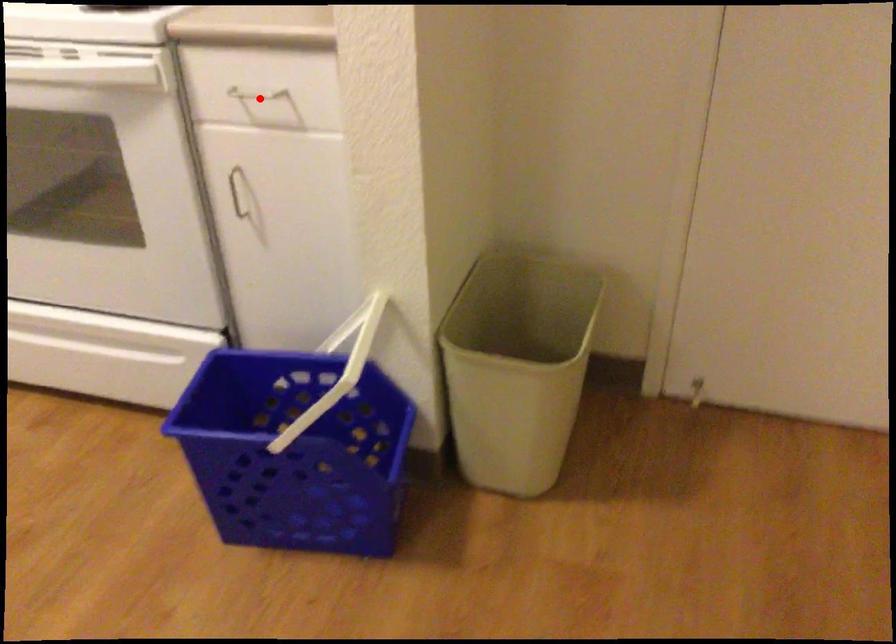
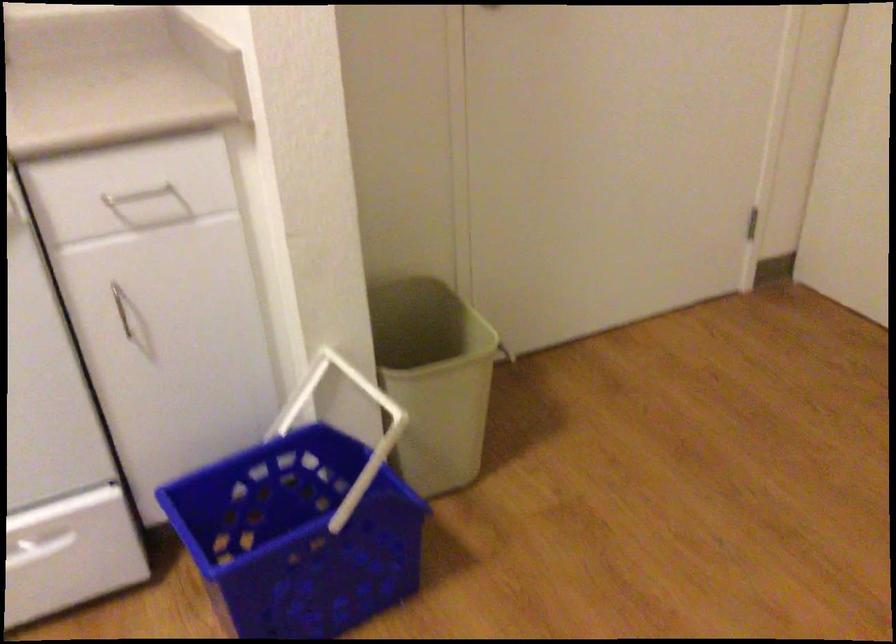
Question: I am providing you with two images of the same scene from different viewpoints. Image1 has a red point marked. In image2, the corresponding 3D location appears at what relative position? Reply with the corresponding letter.

Choices:
 (A) Closer
 (B) Farther

Answer: (A)